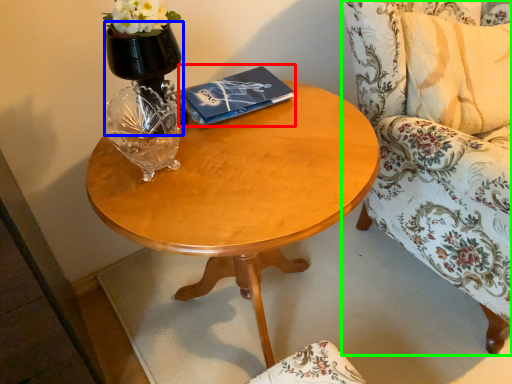
Question: Estimate the real-world distances between objects in this image. Which object is farther from paperback book (highlighted by a red box), vase (highlighted by a blue box) or chair (highlighted by a green box)?

Choices:
 (A) vase
 (B) chair

Answer: (B)